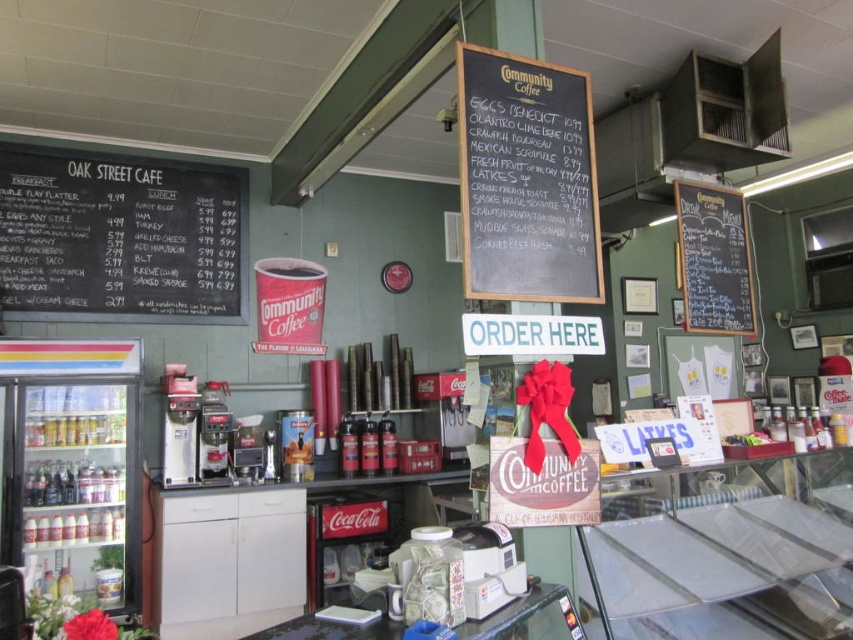
Is black chalkboard menu at left smaller than black chalkboard at upper center?

No, black chalkboard menu at left is not smaller than black chalkboard at upper center.

Based on the photo, who is shorter, black chalkboard menu at left or black chalkboard at upper center?

black chalkboard at upper center is shorter.

Who is more distant from viewer, [184,269] or [515,112]?

The point [184,269] is behind.

You are a GUI agent. You are given a task and a screenshot of the screen. Output one action in this format:
    pyautogui.click(x=<x>, y=<y>)
    Task: Click on the black chalkboard menu at left
    The width and height of the screenshot is (853, 640).
    Given the screenshot: What is the action you would take?
    pyautogui.click(x=120, y=234)

Between point (22, 176) and point (726, 305), which one is positioned in front?

Point (726, 305) is more forward.

Identify the location of black chalkboard menu at left. (120, 234).

Does point (242, 292) come closer to viewer compared to point (711, 285)?

No.

This screenshot has width=853, height=640. In order to click on black chalkboard menu at left in this screenshot , I will do `click(120, 234)`.

The width and height of the screenshot is (853, 640). What do you see at coordinates (526, 179) in the screenshot?
I see `black chalkboard at upper center` at bounding box center [526, 179].

Who is taller, black chalkboard at upper center or black chalkboard menu at upper right?

With more height is black chalkboard at upper center.

What do you see at coordinates (526, 179) in the screenshot? I see `black chalkboard at upper center` at bounding box center [526, 179].

I want to click on black chalkboard at upper center, so click(526, 179).